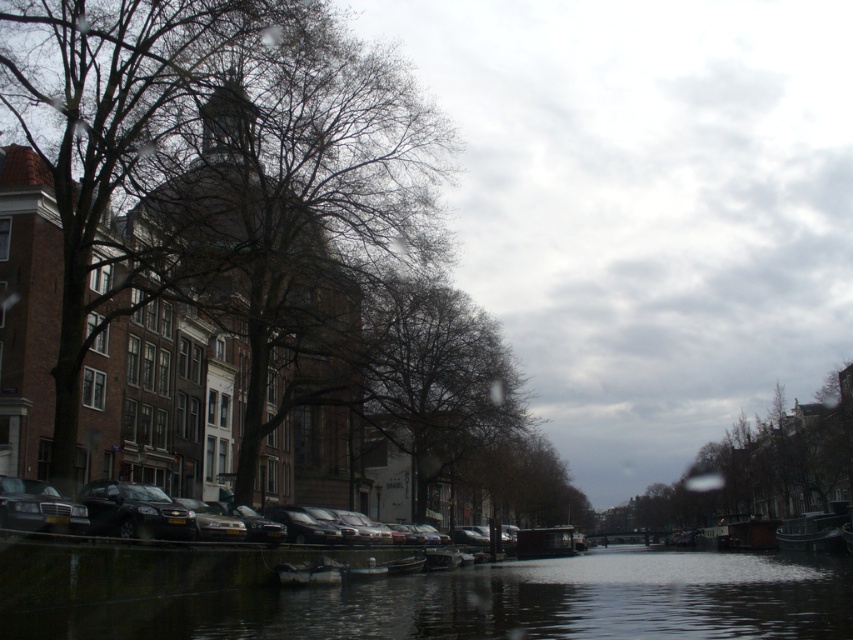
Question: Can you confirm if matte black car at lower left is smaller than metallic silver boat at lower right?

Choices:
 (A) yes
 (B) no

Answer: (A)

Question: Is brown textured building at left to the right of metallic silver boat at lower right from the viewer's perspective?

Choices:
 (A) yes
 (B) no

Answer: (B)

Question: Can you confirm if brown textured building at left is bigger than metallic silver boat at lower right?

Choices:
 (A) yes
 (B) no

Answer: (A)

Question: Which object appears farthest from the camera in this image?

Choices:
 (A) metallic silver boat at lower right
 (B) green leafy tree at center
 (C) dark reflective water at center
 (D) brown textured building at left

Answer: (B)

Question: Which object is farther from the camera taking this photo?

Choices:
 (A) shiny black car at left
 (B) green leafy tree at center
 (C) brown textured building at left
 (D) dark reflective water at center

Answer: (B)

Question: Which of these objects is positioned farthest from the dark reflective water at center?

Choices:
 (A) green leafy tree at center
 (B) shiny black car at left

Answer: (A)